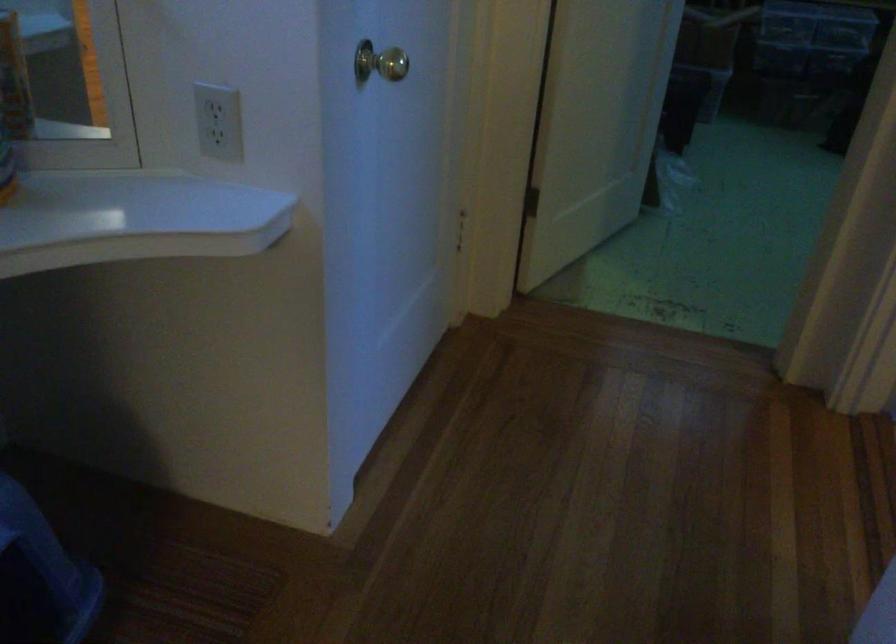
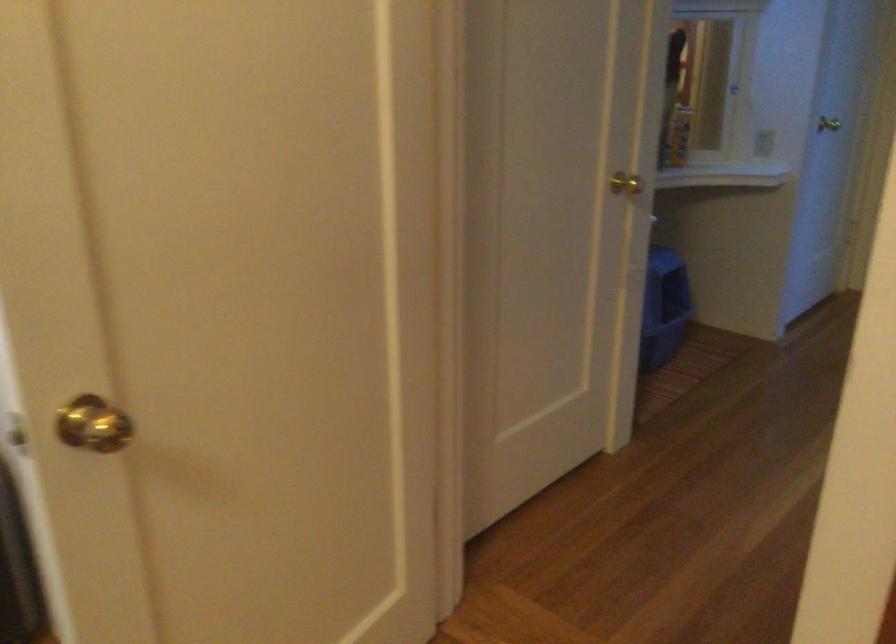
The point at (242,135) is marked in the first image. Where is the corresponding point in the second image?

(762, 143)